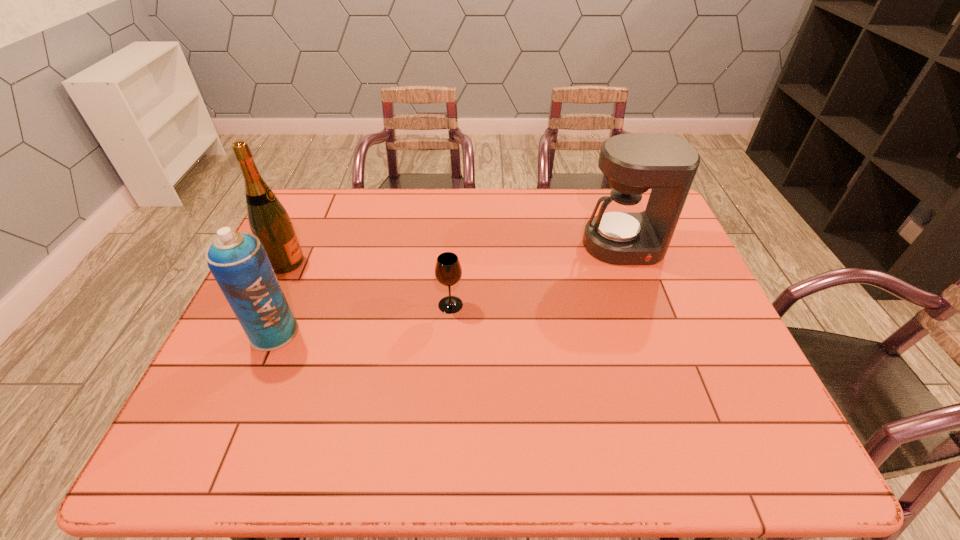
In order to click on vacant space in between the wineglass and the tallest object in this screenshot , I will do `click(369, 284)`.

Where is `free space between the aerosol can and the coffee maker`? This screenshot has height=540, width=960. free space between the aerosol can and the coffee maker is located at coordinates pos(448,289).

Identify the location of free space between the nearest object and the coffee maker. (448, 289).

You are a GUI agent. You are given a task and a screenshot of the screen. Output one action in this format:
    pyautogui.click(x=<x>, y=<y>)
    Task: Click on the vacant area that lies between the third farthest object and the coffee maker
    This screenshot has width=960, height=540.
    Given the screenshot: What is the action you would take?
    pyautogui.click(x=537, y=275)

Image resolution: width=960 pixels, height=540 pixels. Find the location of `vacant space in between the rightmost object and the third object from left to right`. vacant space in between the rightmost object and the third object from left to right is located at coordinates (537, 275).

Where is `free space between the wineglass and the aerosol can`? free space between the wineglass and the aerosol can is located at coordinates (362, 319).

Identify which object is the closest to the rightmost object. Please provide its 2D coordinates. Your answer should be formatted as a tuple, i.e. [(x, y)], where the tuple contains the x and y coordinates of a point satisfying the conditions above.

[(448, 271)]

Find the location of a particular element. object that stands as the third closest to the wineglass is located at coordinates (268, 219).

Where is `vacant space that satisfies the following two spatial constraints: 1. on the front-facing side of the third object from left to right; 2. on the right side of the tallest object`? vacant space that satisfies the following two spatial constraints: 1. on the front-facing side of the third object from left to right; 2. on the right side of the tallest object is located at coordinates (266, 305).

The height and width of the screenshot is (540, 960). What are the coordinates of `free point that satisfies the following two spatial constraints: 1. on the front-facing side of the wine bottle; 2. on the right side of the third farthest object` in the screenshot? It's located at (266, 305).